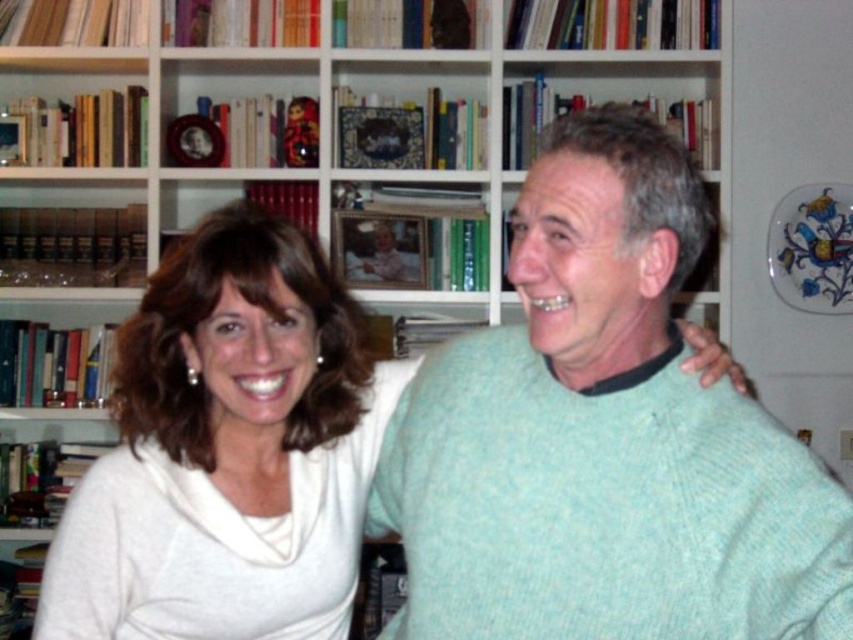
Question: Which of the following is the farthest from the observer?

Choices:
 (A) light green knitted sweater at center
 (B) white soft sweater at left

Answer: (B)

Question: Observing the image, what is the correct spatial positioning of light green knitted sweater at center in reference to white soft sweater at left?

Choices:
 (A) right
 (B) left

Answer: (A)

Question: Is light green knitted sweater at center bigger than white soft sweater at left?

Choices:
 (A) yes
 (B) no

Answer: (A)

Question: Which of the following is the farthest from the observer?

Choices:
 (A) (573, 173)
 (B) (79, 566)

Answer: (B)

Question: In this image, where is light green knitted sweater at center located relative to white soft sweater at left?

Choices:
 (A) left
 (B) right

Answer: (B)